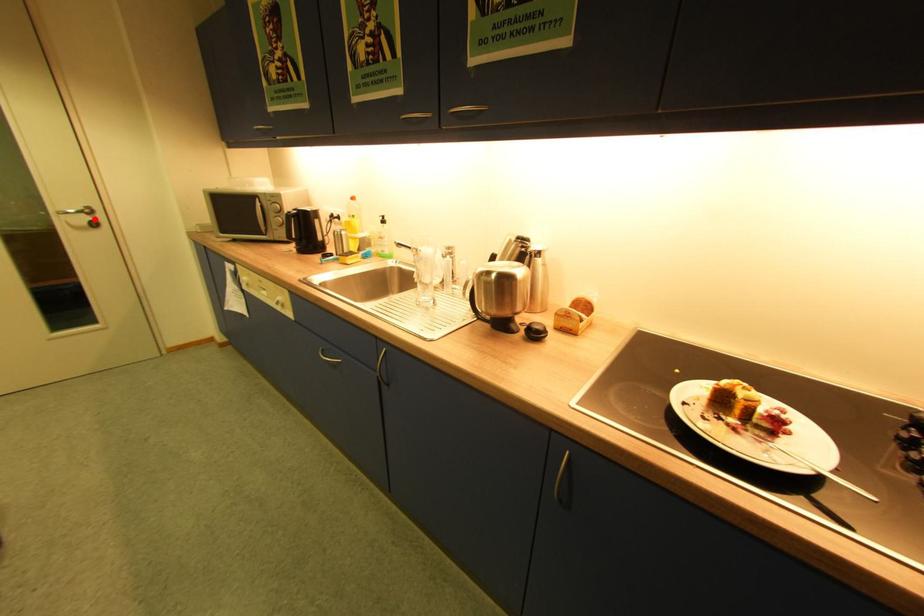
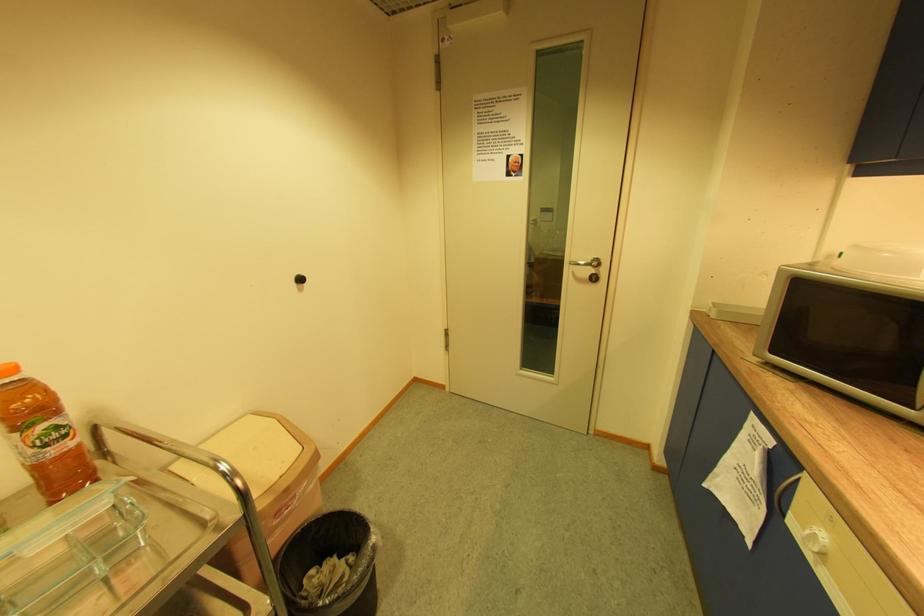
Locate, in the second image, the point that corresponds to the highlighted location in the first image.

(598, 272)